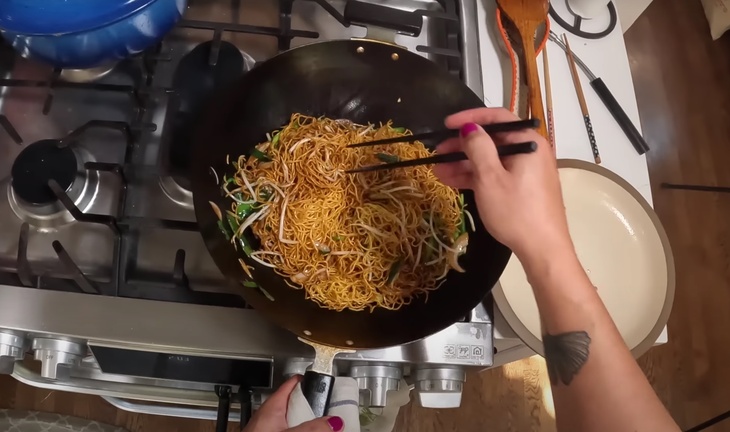
The image size is (730, 432). In order to click on knob in this screenshot , I will do `click(303, 412)`.